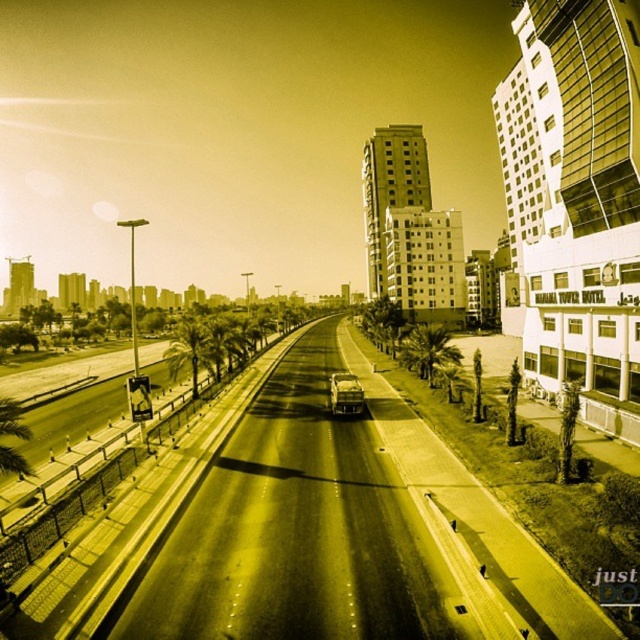
Question: Estimate the real-world distances between objects in this image. Which object is farther from the green leafy palm tree at center-left?

Choices:
 (A) green leafy palm tree at center-right
 (B) green leafy palm tree at right

Answer: (B)

Question: Which is farther from the green leafy palm tree at center-left?

Choices:
 (A) green leafy palm tree at right
 (B) green leafy palm tree at center-right
 (C) shiny silver car at center

Answer: (A)

Question: Does green leafy palm tree at right have a greater width compared to shiny silver car at center?

Choices:
 (A) yes
 (B) no

Answer: (A)

Question: Does green leafy palm tree at center-right appear under shiny silver car at center?

Choices:
 (A) no
 (B) yes

Answer: (A)

Question: Considering the relative positions of green leafy palm tree at center-left and shiny silver car at center in the image provided, where is green leafy palm tree at center-left located with respect to shiny silver car at center?

Choices:
 (A) left
 (B) right

Answer: (A)

Question: Considering the real-world distances, which object is closest to the green leafy palm tree at right?

Choices:
 (A) green leafy palm tree at center-right
 (B) green leafy palm tree at center-left
 (C) shiny silver car at center

Answer: (C)